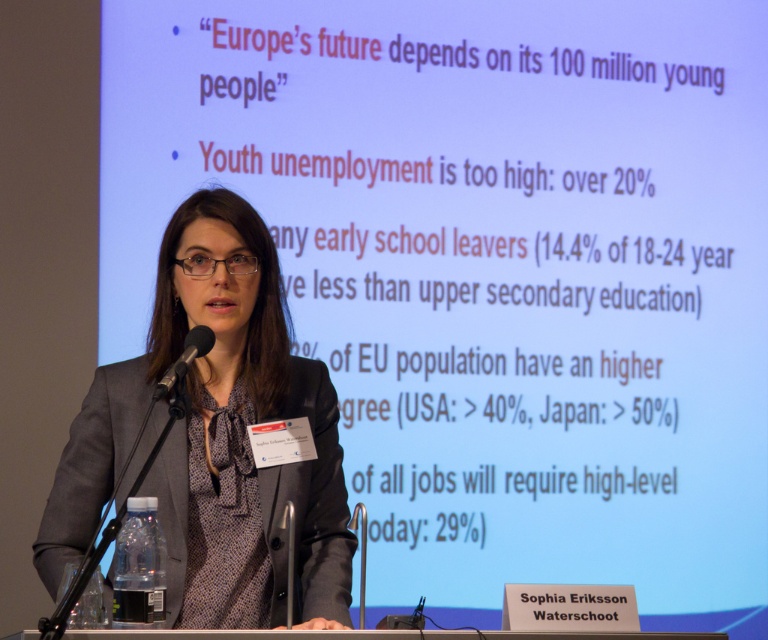
Question: Is matte gray blazer at center to the left of black matte microphone at left from the viewer's perspective?

Choices:
 (A) yes
 (B) no

Answer: (A)

Question: Which object is closer to the camera taking this photo?

Choices:
 (A) matte gray blazer at center
 (B) black matte microphone at left

Answer: (B)

Question: Can you confirm if matte gray blazer at center is positioned below black matte microphone at left?

Choices:
 (A) yes
 (B) no

Answer: (A)

Question: Where is matte gray blazer at center located in relation to black matte microphone at left in the image?

Choices:
 (A) above
 (B) below

Answer: (B)

Question: Which object appears farthest from the camera in this image?

Choices:
 (A) black matte microphone at left
 (B) matte gray blazer at center

Answer: (B)

Question: Which object is farther from the camera taking this photo?

Choices:
 (A) black matte microphone at left
 (B) matte gray blazer at center

Answer: (B)